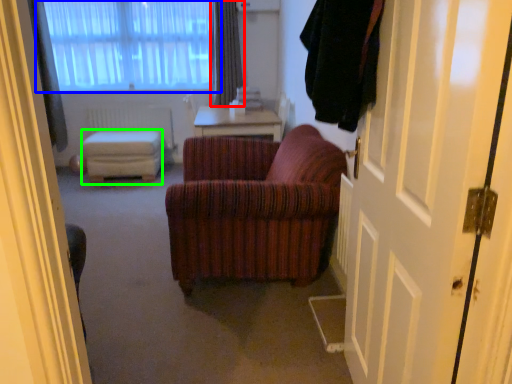
Question: Estimate the real-world distances between objects in this image. Which object is farther from curtain (highlighted by a red box), window (highlighted by a blue box) or stool (highlighted by a green box)?

Choices:
 (A) window
 (B) stool

Answer: (B)